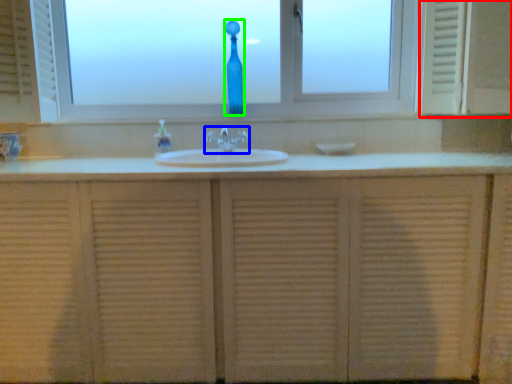
Question: Considering the real-world distances, which object is closest to medicine cabinet (highlighted by a red box)? tap (highlighted by a blue box) or glass vase (highlighted by a green box).

Choices:
 (A) tap
 (B) glass vase

Answer: (A)